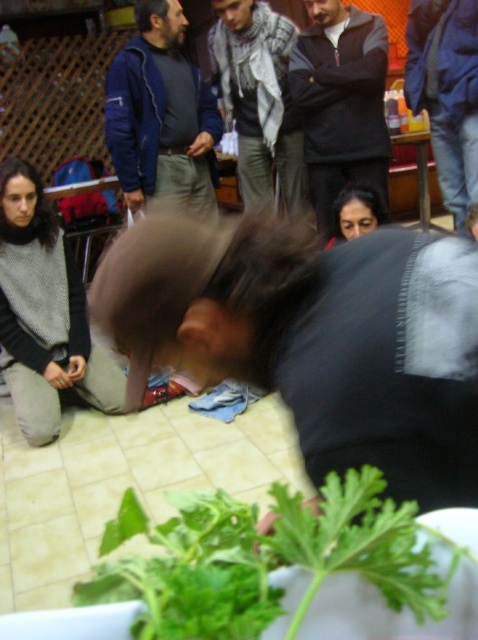
Question: Is plaid scarf at upper center below matte black hair at center?

Choices:
 (A) no
 (B) yes

Answer: (A)

Question: Where is knit sweater at lower left located in relation to dark gray sweater at center in the image?

Choices:
 (A) left
 (B) right

Answer: (A)

Question: Among these points, which one is nearest to the camera?

Choices:
 (A) (198, 134)
 (B) (443, 81)
 (C) (367, 497)

Answer: (C)

Question: Does dark gray sweatshirt at center appear over plaid scarf at upper center?

Choices:
 (A) yes
 (B) no

Answer: (B)

Question: Which point is farther from the camera taking this photo?

Choices:
 (A) (137, 531)
 (B) (125, 189)
 (C) (242, 176)
 (D) (383, 86)

Answer: (C)

Question: Among these objects, which one is farthest from the camera?

Choices:
 (A) blue denim jeans at lower right
 (B) dark gray sweatshirt at center
 (C) dark gray sweater at center
 (D) plaid scarf at upper center

Answer: (D)